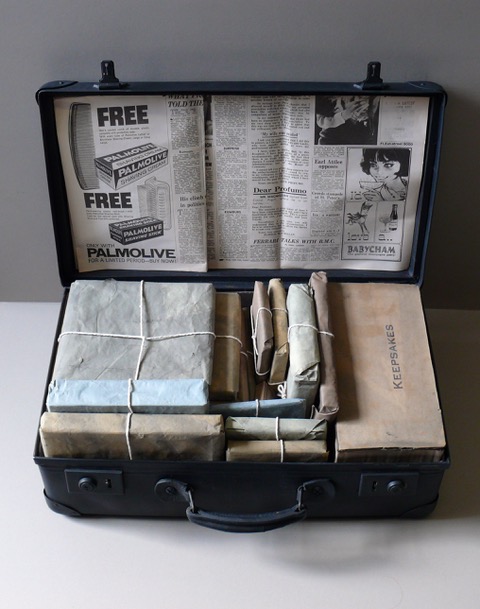
Identify the location of box. (134, 500).